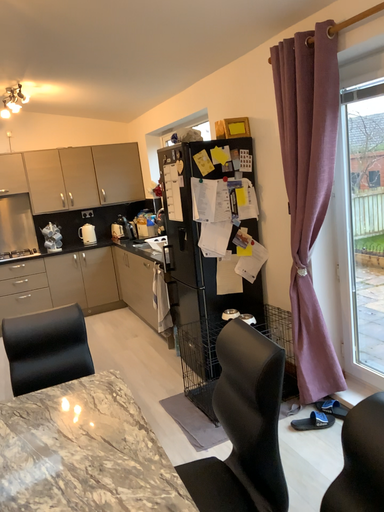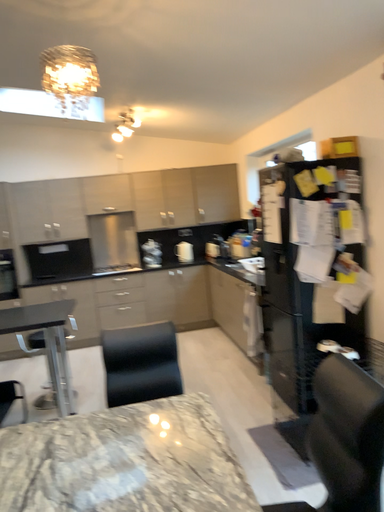
Question: Which way did the camera rotate in the video?

Choices:
 (A) rotated right
 (B) rotated left

Answer: (B)